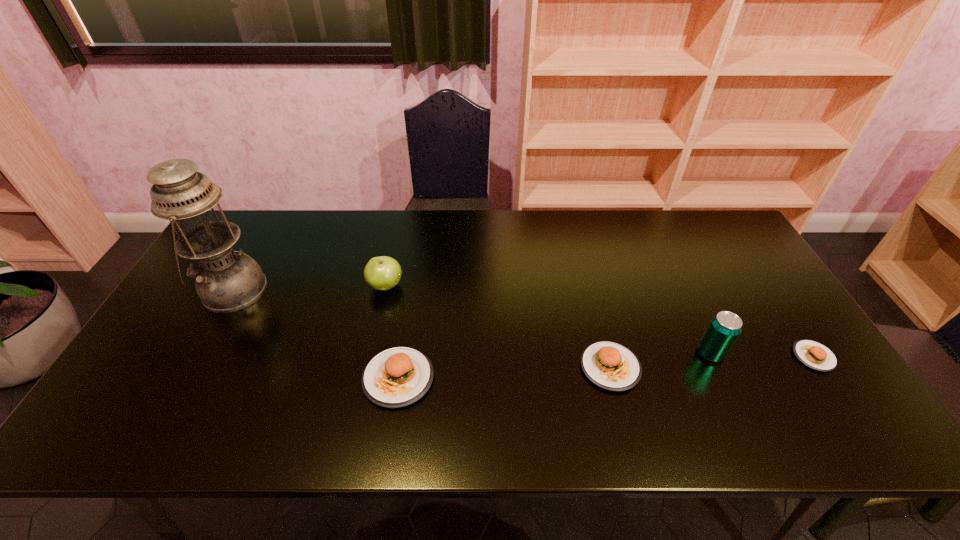
At what (x,y) coordinates should I click in order to perform the action: click on free space located 0.380m on the back of the third object from right to left. Please return your answer as a coordinate pair (x, y). Image resolution: width=960 pixels, height=540 pixels. Looking at the image, I should click on (581, 249).

This screenshot has height=540, width=960. What are the coordinates of `blank area located 0.140m on the left of the shortest food` in the screenshot? It's located at (739, 356).

At what (x,y) coordinates should I click in order to perform the action: click on free spot located on the back of the oil lamp. Please return your answer as a coordinate pair (x, y). This screenshot has width=960, height=540. Looking at the image, I should click on (268, 228).

The height and width of the screenshot is (540, 960). What are the coordinates of `vacant space located 0.190m on the back of the fifth object from left to right` in the screenshot? It's located at (682, 291).

You are a GUI agent. You are given a task and a screenshot of the screen. Output one action in this format:
    pyautogui.click(x=<x>, y=<y>)
    Task: Click on the vacant space located on the left of the apple
    
    Given the screenshot: What is the action you would take?
    pyautogui.click(x=267, y=286)

This screenshot has height=540, width=960. Identify the location of object at the left edge. (226, 281).

At what (x,y) coordinates should I click in order to perform the action: click on object that is at the right edge. Please return your answer as a coordinate pair (x, y). The image size is (960, 540). Looking at the image, I should click on (814, 355).

Identify the location of object positioned at the near right corner. The image size is (960, 540). (814, 355).

Locate an element on the screen. The image size is (960, 540). vacant space at the far edge is located at coordinates (681, 254).

This screenshot has height=540, width=960. In the image, there is a desktop. In order to click on vacant region at the near edge in this screenshot , I will do `click(656, 395)`.